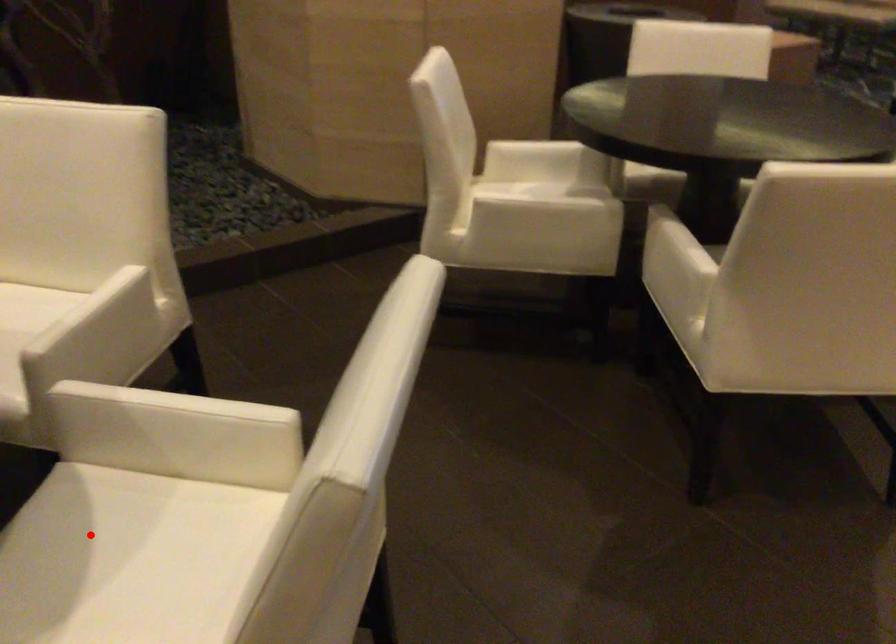
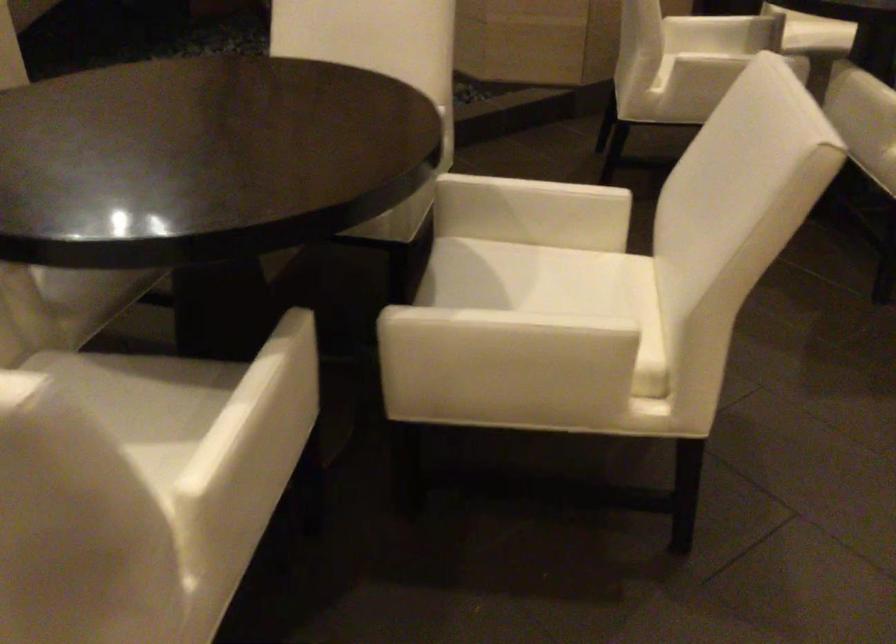
Question: I am providing you with two images of the same scene from different viewpoints. Given a red point in image1, look at the same physical point in image2. Is it:

Choices:
 (A) Closer to the viewpoint
 (B) Farther from the viewpoint

Answer: (B)